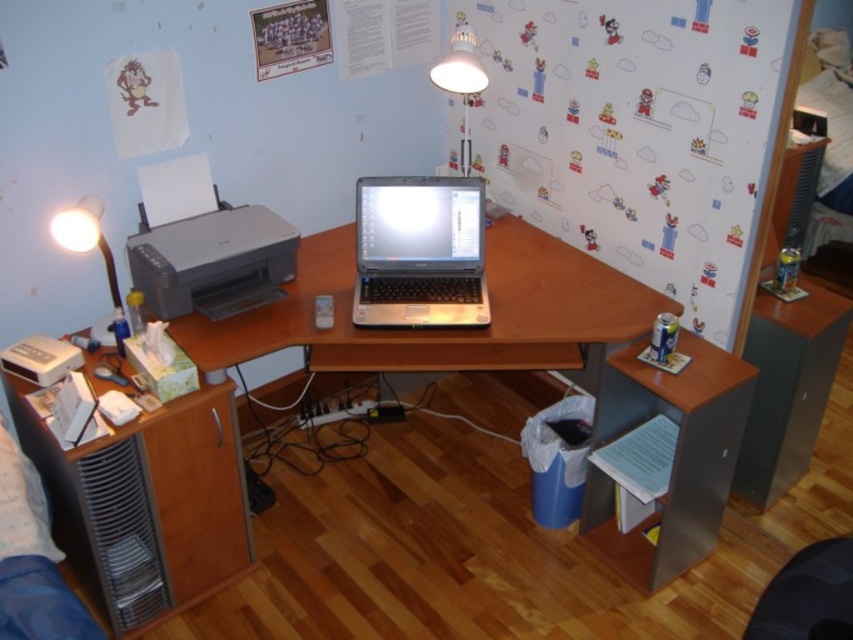
Question: Is white paperboard at center below white plastic lamp at upper left?

Choices:
 (A) no
 (B) yes

Answer: (A)

Question: Does white paperboard at center appear over white plastic lamp at upper left?

Choices:
 (A) no
 (B) yes

Answer: (B)

Question: Estimate the real-world distances between objects in this image. Which object is closer to the white plastic lamp at upper left?

Choices:
 (A) white glossy lamp at upper center
 (B) silver metallic laptop at center
 (C) white paperboard at center
 (D) black leather chair at lower right

Answer: (B)

Question: Estimate the real-world distances between objects in this image. Which object is closer to the silver metallic laptop at center?

Choices:
 (A) black leather chair at lower right
 (B) matte gray printer at left
 (C) white plastic lamp at upper left

Answer: (B)

Question: Does white paperboard at center appear under white plastic lamp at upper left?

Choices:
 (A) no
 (B) yes

Answer: (A)

Question: Estimate the real-world distances between objects in this image. Which object is farther from the silver metallic laptop at center?

Choices:
 (A) white glossy lamp at upper center
 (B) white plastic lamp at upper left
 (C) matte gray printer at left
 (D) black leather chair at lower right

Answer: (D)